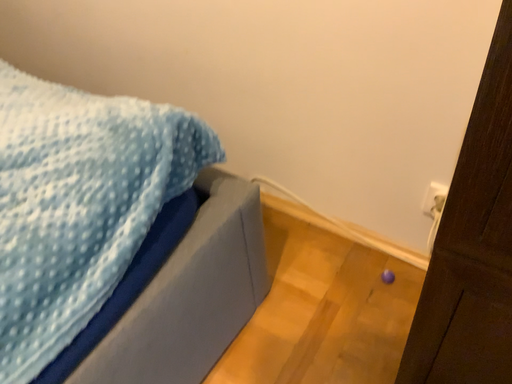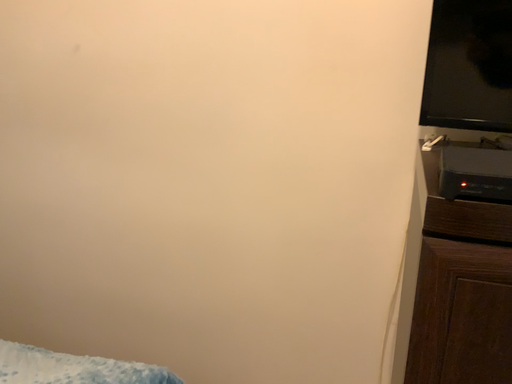
Question: Which way did the camera rotate in the video?

Choices:
 (A) rotated right
 (B) rotated left

Answer: (A)